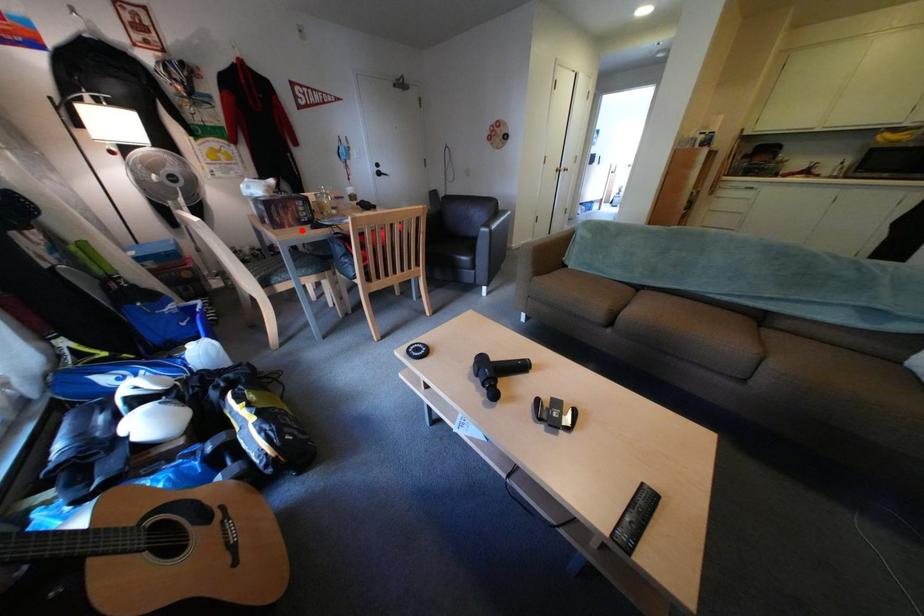
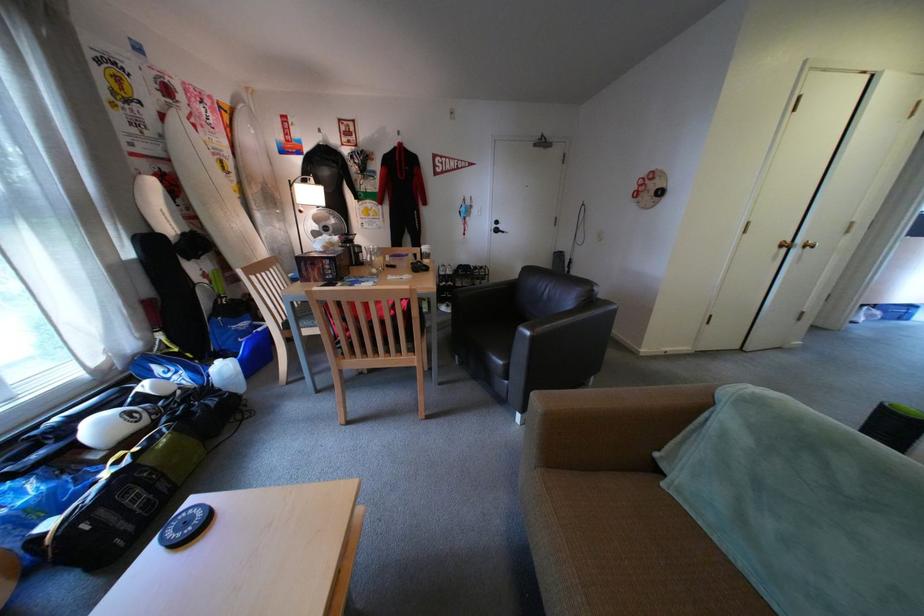
Question: I am providing you with two images of the same scene from different viewpoints. A red point is marked on the first image. Is the red point's position out of view in image 2?

Choices:
 (A) Yes
 (B) No

Answer: (B)